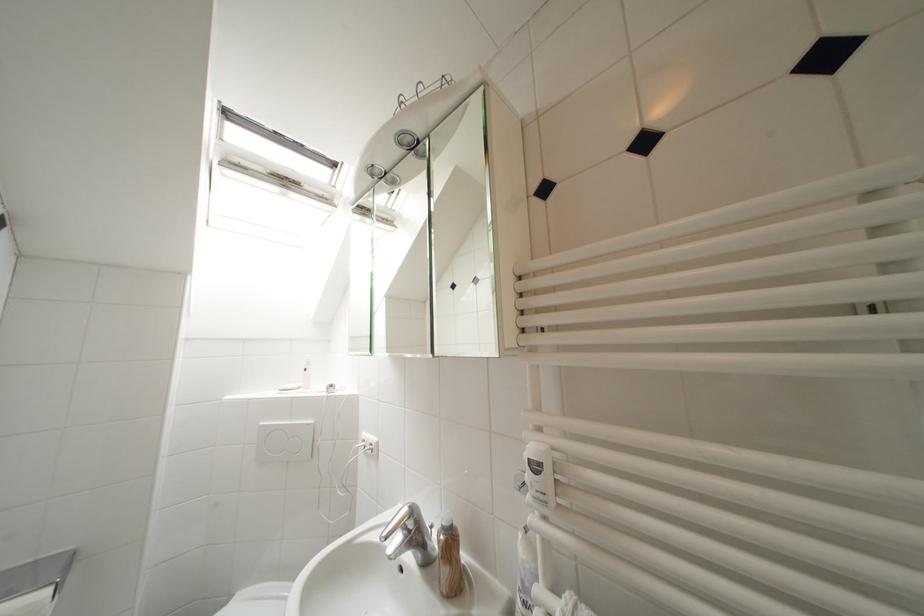
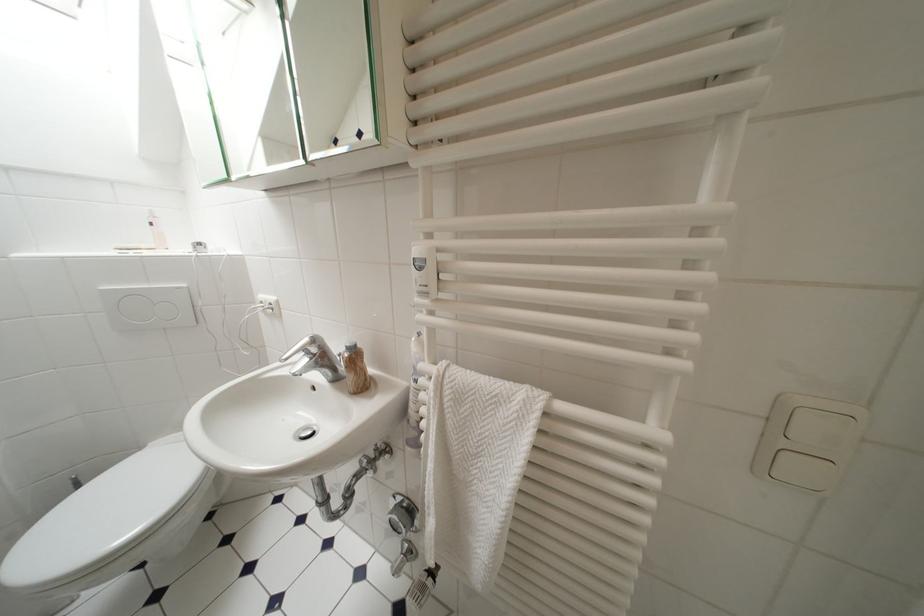
Based on the continuous images, in which direction is the camera rotating?

The camera rotated toward right-down.